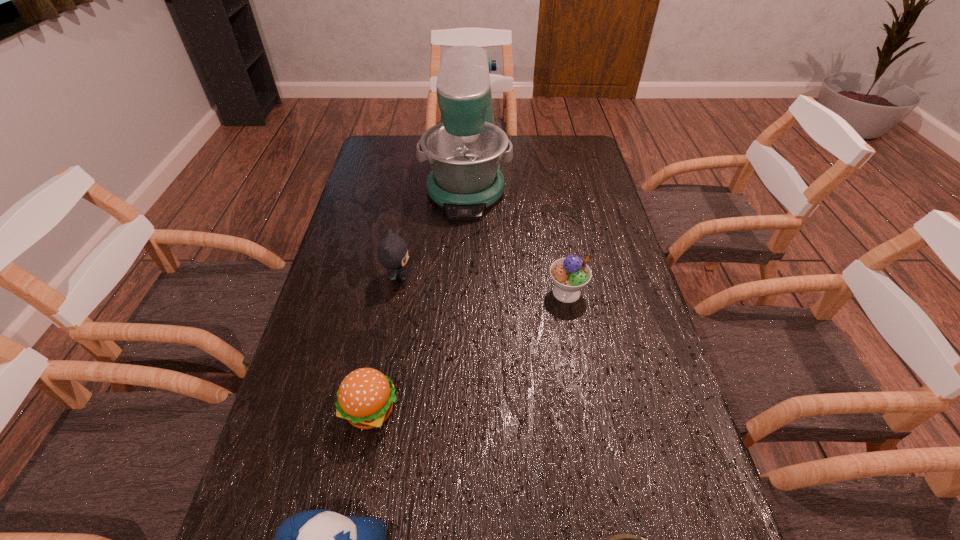
Identify which object is the second nearest to the mixer. Please provide its 2D coordinates. Your answer should be formatted as a tuple, i.e. [(x, y)], where the tuple contains the x and y coordinates of a point satisfying the conditions above.

[(571, 274)]

Point out which object is positioned as the fourth nearest to the icecream. Please provide its 2D coordinates. Your answer should be formatted as a tuple, i.e. [(x, y)], where the tuple contains the x and y coordinates of a point satisfying the conditions above.

[(620, 539)]

I want to click on free region that satisfies the following two spatial constraints: 1. on the back side of the icecream; 2. on the front-facing side of the kitten, so click(564, 277).

In order to click on vacant space that satisfies the following two spatial constraints: 1. on the front-facing side of the tallest object; 2. on the front-facing side of the kitten in this screenshot , I will do `click(463, 277)`.